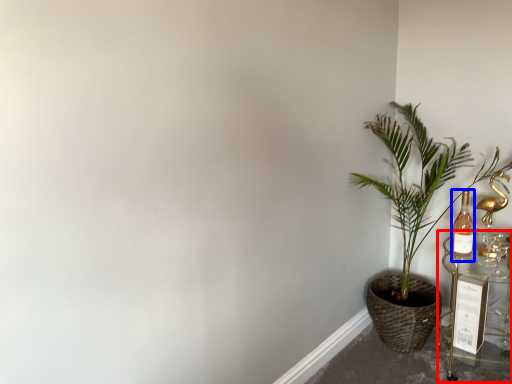
Question: Which of the following is the farthest to the observer, table (highlighted by a red box) or bottle (highlighted by a blue box)?

Choices:
 (A) table
 (B) bottle

Answer: (B)